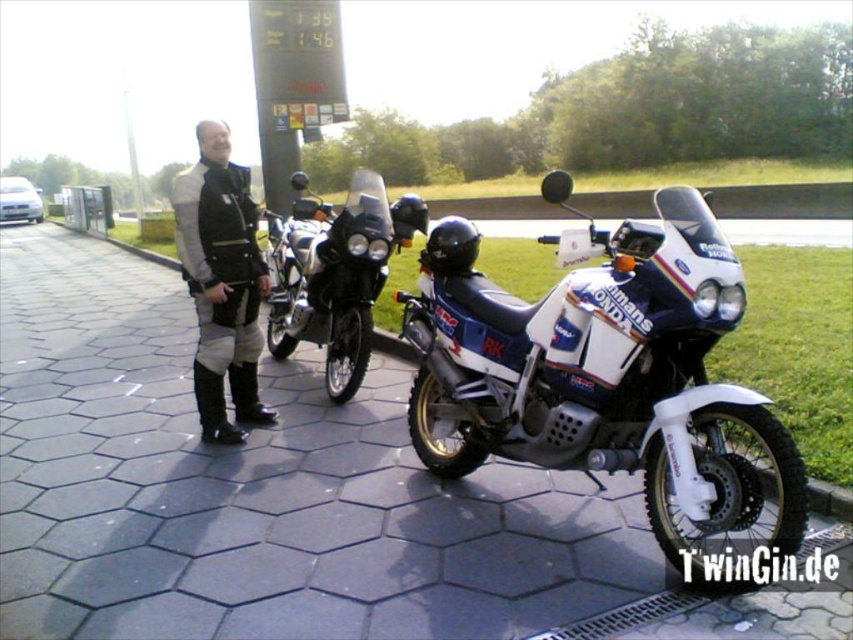
You are standing at the gas station and want to clean the white matte motorcycle at center. To avoid stepping on the dark gray hexagonal tiles at center, which direction should you approach from?

To avoid stepping on the dark gray hexagonal tiles at center, you should approach the white matte motorcycle at center from the right side, since the tiles are located to the left of the motorcycle.